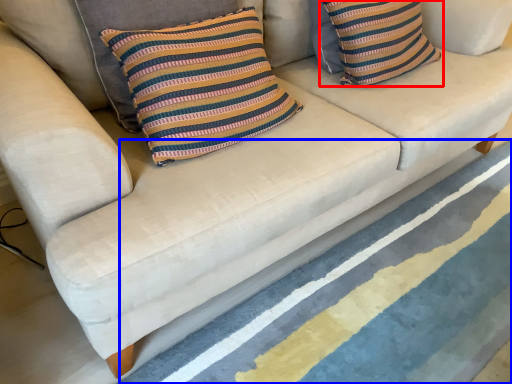
Question: Which object is further to the camera taking this photo, pillow (highlighted by a red box) or stripe (highlighted by a blue box)?

Choices:
 (A) pillow
 (B) stripe

Answer: (A)